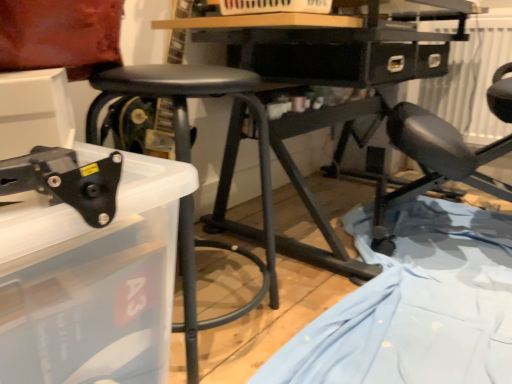
Question: Is black matte stool at center taller than light blue fabric at lower right?

Choices:
 (A) yes
 (B) no

Answer: (A)

Question: Does black matte stool at center have a lesser width compared to light blue fabric at lower right?

Choices:
 (A) yes
 (B) no

Answer: (A)

Question: Would you say black matte stool at center is outside light blue fabric at lower right?

Choices:
 (A) no
 (B) yes

Answer: (B)

Question: Would you consider black matte stool at center to be distant from light blue fabric at lower right?

Choices:
 (A) no
 (B) yes

Answer: (A)

Question: Considering the relative positions of black matte stool at center and light blue fabric at lower right in the image provided, is black matte stool at center in front of light blue fabric at lower right?

Choices:
 (A) yes
 (B) no

Answer: (B)

Question: Is black matte stool at center turned away from light blue fabric at lower right?

Choices:
 (A) yes
 (B) no

Answer: (B)

Question: Does light blue fabric at lower right turn towards black matte stool at center?

Choices:
 (A) no
 (B) yes

Answer: (A)

Question: Considering the relative positions of light blue fabric at lower right and black matte stool at center in the image provided, is light blue fabric at lower right behind black matte stool at center?

Choices:
 (A) yes
 (B) no

Answer: (B)

Question: Can you confirm if light blue fabric at lower right is thinner than black matte stool at center?

Choices:
 (A) yes
 (B) no

Answer: (B)

Question: From the image's perspective, is light blue fabric at lower right under black matte stool at center?

Choices:
 (A) no
 (B) yes

Answer: (B)

Question: Is the depth of light blue fabric at lower right less than that of black matte stool at center?

Choices:
 (A) no
 (B) yes

Answer: (B)

Question: Can you confirm if light blue fabric at lower right is shorter than black matte stool at center?

Choices:
 (A) yes
 (B) no

Answer: (A)

Question: Considering the relative positions of black matte stool at center and black plastic tool at lower left in the image provided, is black matte stool at center to the left of black plastic tool at lower left from the viewer's perspective?

Choices:
 (A) no
 (B) yes

Answer: (A)